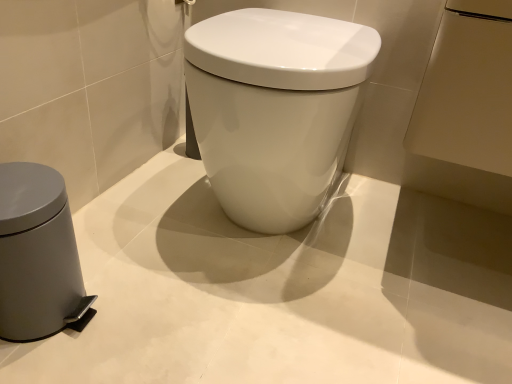
Find the location of a particular element. This screenshot has height=384, width=512. gray matte waste container at left is located at coordinates (37, 255).

Locate an element on the screen. Image resolution: width=512 pixels, height=384 pixels. metallic silver towel bar at upper center is located at coordinates (185, 2).

Considering the relative positions of gray matte waste container at left and metallic silver towel bar at upper center in the image provided, is gray matte waste container at left to the left or to the right of metallic silver towel bar at upper center?

From the image, it's evident that gray matte waste container at left is to the left of metallic silver towel bar at upper center.

In the scene shown: From their relative heights in the image, would you say gray matte waste container at left is taller or shorter than metallic silver towel bar at upper center?

Clearly, gray matte waste container at left is taller compared to metallic silver towel bar at upper center.

From the image's perspective, does gray matte waste container at left appear higher than metallic silver towel bar at upper center?

No, from the image's perspective, gray matte waste container at left is not on top of metallic silver towel bar at upper center.

Is gray matte waste container at left not close to metallic silver towel bar at upper center?

gray matte waste container at left is actually quite close to metallic silver towel bar at upper center.

From a real-world perspective, does gray matte waste container at left stand above white glossy toilet at center?

No.

This screenshot has height=384, width=512. What are the coordinates of `toilet lying behind the gray matte waste container at left` in the screenshot? It's located at (274, 109).

Would you say gray matte waste container at left is to the left or to the right of white glossy toilet at center in the picture?

gray matte waste container at left is to the left of white glossy toilet at center.

Is gray matte waste container at left wider or thinner than white glossy toilet at center?

In the image, gray matte waste container at left appears to be more narrow than white glossy toilet at center.

Does white glossy toilet at center turn towards metallic silver towel bar at upper center?

No.

Does white glossy toilet at center lie in front of metallic silver towel bar at upper center?

That is True.

How different are the orientations of white glossy toilet at center and metallic silver towel bar at upper center in degrees?

They differ by 89.3 degrees in their facing directions.

Is white glossy toilet at center completely or partially outside of metallic silver towel bar at upper center?

white glossy toilet at center lies outside metallic silver towel bar at upper center's area.

Considering the relative positions of white glossy toilet at center and gray matte waste container at left in the image provided, is white glossy toilet at center to the left or to the right of gray matte waste container at left?

From the image, it's evident that white glossy toilet at center is to the right of gray matte waste container at left.

Are white glossy toilet at center and gray matte waste container at left beside each other?

white glossy toilet at center and gray matte waste container at left are not in contact.

From the image's perspective, which one is positioned lower, white glossy toilet at center or gray matte waste container at left?

gray matte waste container at left.

Does metallic silver towel bar at upper center have a lesser width compared to white glossy toilet at center?

Indeed, metallic silver towel bar at upper center has a lesser width compared to white glossy toilet at center.

Based on their sizes in the image, would you say metallic silver towel bar at upper center is bigger or smaller than white glossy toilet at center?

Clearly, metallic silver towel bar at upper center is smaller in size than white glossy toilet at center.

Which of these two, metallic silver towel bar at upper center or white glossy toilet at center, stands shorter?

With less height is metallic silver towel bar at upper center.

How different are the orientations of metallic silver towel bar at upper center and white glossy toilet at center in degrees?

89.3 degrees.

Is point (176, 0) farther from viewer compared to point (11, 256)?

That is True.

You are a GUI agent. You are given a task and a screenshot of the screen. Output one action in this format:
    pyautogui.click(x=<x>, y=<y>)
    Task: Click on the waste container that appears below the metallic silver towel bar at upper center (from a real-world perspective)
    
    Given the screenshot: What is the action you would take?
    pyautogui.click(x=37, y=255)

From a real-world perspective, is metallic silver towel bar at upper center above or below gray matte waste container at left?

Clearly, from a real-world perspective, metallic silver towel bar at upper center is above gray matte waste container at left.

Can you tell me how much metallic silver towel bar at upper center and gray matte waste container at left differ in facing direction?

The angle between the facing direction of metallic silver towel bar at upper center and the facing direction of gray matte waste container at left is 0.207 degrees.

In order to click on towel bar located behind the gray matte waste container at left in this screenshot , I will do `click(185, 2)`.

You are a GUI agent. You are given a task and a screenshot of the screen. Output one action in this format:
    pyautogui.click(x=<x>, y=<y>)
    Task: Click on the waste container below the white glossy toilet at center (from the image's perspective)
    This screenshot has width=512, height=384.
    Given the screenshot: What is the action you would take?
    pyautogui.click(x=37, y=255)

Consider the image. When comparing their distances from gray matte waste container at left, does white glossy toilet at center or metallic silver towel bar at upper center seem closer?

white glossy toilet at center is positioned closer to the anchor gray matte waste container at left.

From the picture: When comparing their distances from white glossy toilet at center, does gray matte waste container at left or metallic silver towel bar at upper center seem further?

gray matte waste container at left.

From the image, which object appears to be farther from white glossy toilet at center, metallic silver towel bar at upper center or gray matte waste container at left?

Among the two, gray matte waste container at left is located further to white glossy toilet at center.

Considering their positions, is metallic silver towel bar at upper center positioned further to gray matte waste container at left than white glossy toilet at center?

metallic silver towel bar at upper center.

From the image, which object appears to be nearer to metallic silver towel bar at upper center, white glossy toilet at center or gray matte waste container at left?

white glossy toilet at center lies closer to metallic silver towel bar at upper center than the other object.

Estimate the real-world distances between objects in this image. Which object is closer to metallic silver towel bar at upper center, gray matte waste container at left or white glossy toilet at center?

white glossy toilet at center.

The width and height of the screenshot is (512, 384). I want to click on toilet between metallic silver towel bar at upper center and gray matte waste container at left in the up-down direction, so click(274, 109).